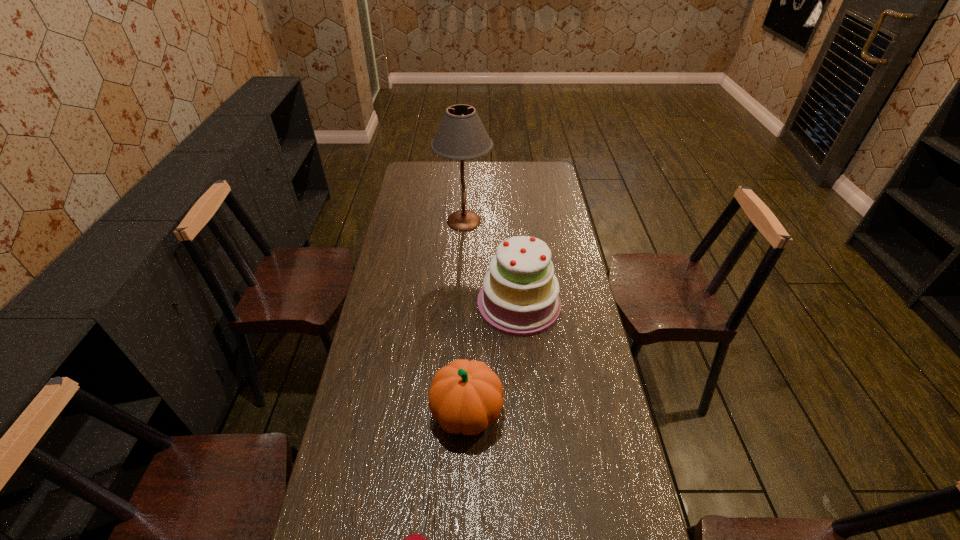
Where is `vacant area between the tallest object and the third tallest object`? Image resolution: width=960 pixels, height=540 pixels. vacant area between the tallest object and the third tallest object is located at coordinates (466, 316).

Where is `object that is the third closest one to the tallest object`? object that is the third closest one to the tallest object is located at coordinates (415, 539).

You are a GUI agent. You are given a task and a screenshot of the screen. Output one action in this format:
    pyautogui.click(x=<x>, y=<y>)
    Task: Click on the third closest object to the wineglass
    
    Given the screenshot: What is the action you would take?
    pyautogui.click(x=461, y=135)

In order to click on vacant region that satisfies the following two spatial constraints: 1. on the front-facing side of the table lamp; 2. on the left side of the second tallest object in this screenshot , I will do `click(460, 305)`.

Where is `vacant point that satisfies the following two spatial constraints: 1. on the front-facing side of the farthest object; 2. on the left side of the second farthest object`? The image size is (960, 540). vacant point that satisfies the following two spatial constraints: 1. on the front-facing side of the farthest object; 2. on the left side of the second farthest object is located at coordinates (460, 305).

The width and height of the screenshot is (960, 540). I want to click on free space that satisfies the following two spatial constraints: 1. on the back side of the cake; 2. on the left side of the pumpkin, so click(x=469, y=305).

This screenshot has height=540, width=960. I want to click on vacant space that satisfies the following two spatial constraints: 1. on the back side of the pumpkin; 2. on the front-facing side of the farthest object, so click(471, 221).

What are the coordinates of `free spot that satisfies the following two spatial constraints: 1. on the front-facing side of the farthest object; 2. on the left side of the third farthest object` in the screenshot? It's located at (455, 413).